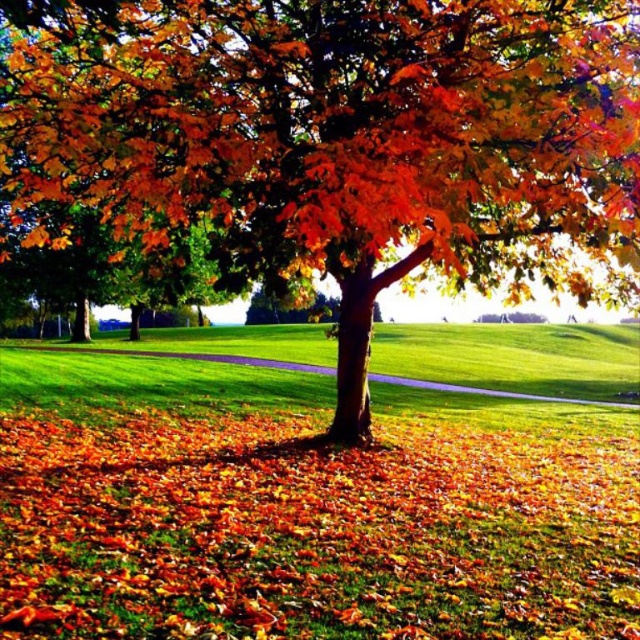
Which is more to the left, shiny orange leaves at center or green grass at center?

shiny orange leaves at center is more to the left.

Is shiny orange leaves at center bigger than green grass at center?

Incorrect, shiny orange leaves at center is not larger than green grass at center.

Image resolution: width=640 pixels, height=640 pixels. Describe the element at coordinates (342, 140) in the screenshot. I see `shiny orange leaves at center` at that location.

You are a GUI agent. You are given a task and a screenshot of the screen. Output one action in this format:
    pyautogui.click(x=<x>, y=<y>)
    Task: Click on the shiny orange leaves at center
    
    Given the screenshot: What is the action you would take?
    pyautogui.click(x=342, y=140)